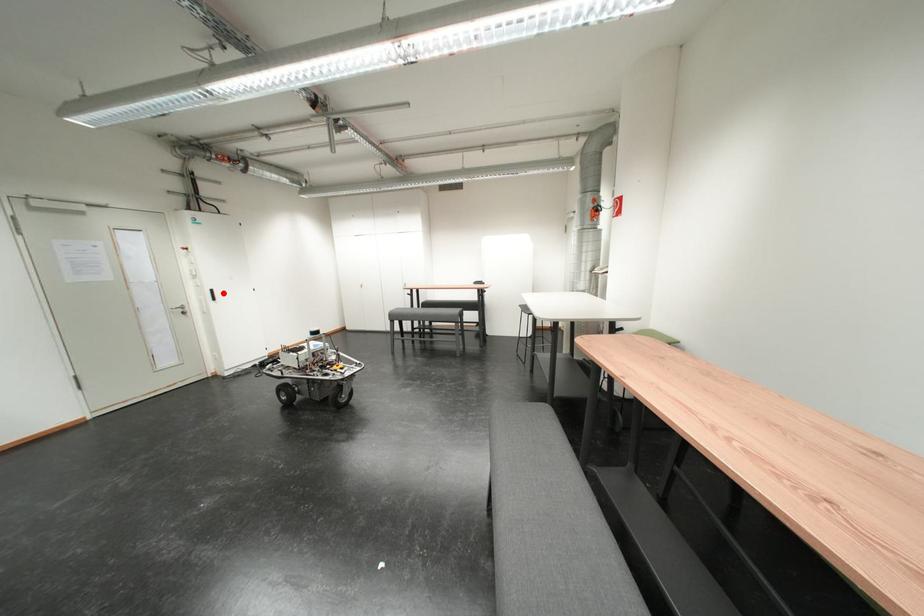
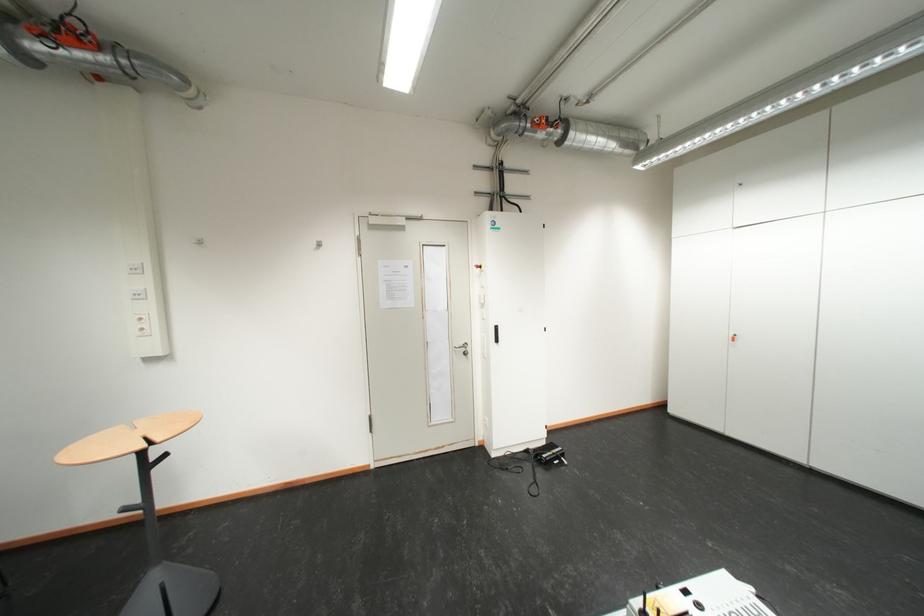
Locate, in the second image, the point that corresponds to the highlighted location in the first image.

(507, 330)